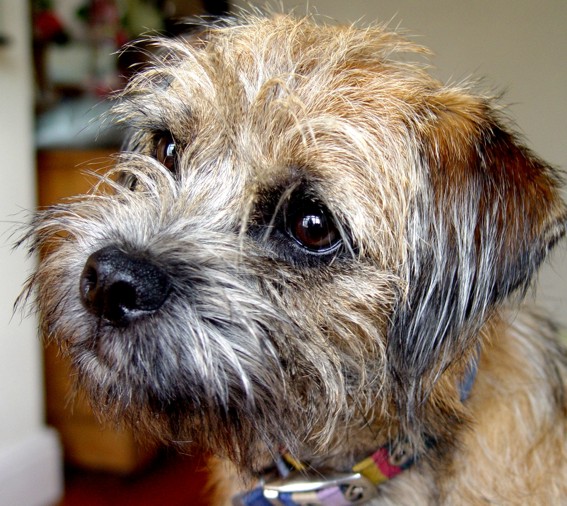
Find the location of `wodden furniture`. wodden furniture is located at coordinates (62, 183).